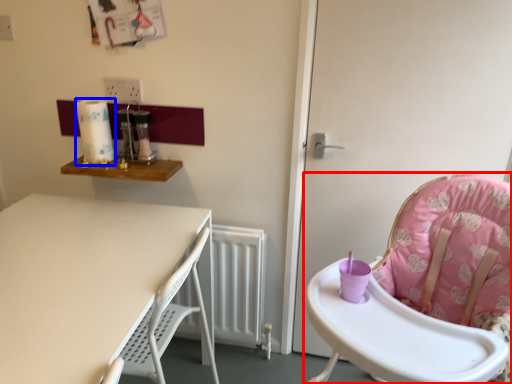
Question: Which object is closer to the camera taking this photo, chair (highlighted by a red box) or paper towel (highlighted by a blue box)?

Choices:
 (A) chair
 (B) paper towel

Answer: (A)